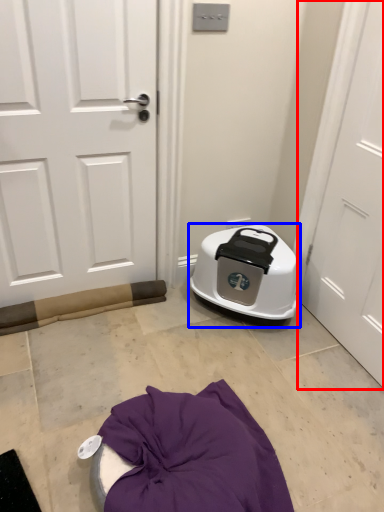
Question: Which object appears farthest to the camera in this image, door (highlighted by a red box) or appliance (highlighted by a blue box)?

Choices:
 (A) door
 (B) appliance

Answer: (B)